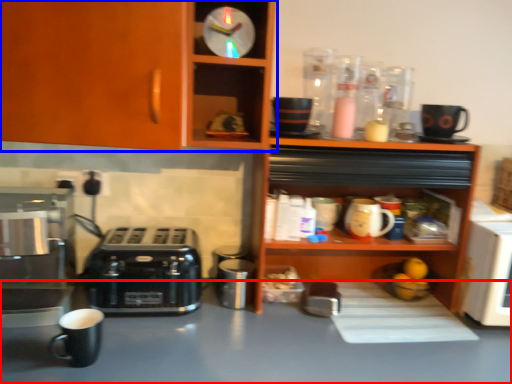
Question: Which point is closer to the camera, table (highlighted by a red box) or cabinetry (highlighted by a blue box)?

Choices:
 (A) table
 (B) cabinetry

Answer: (A)